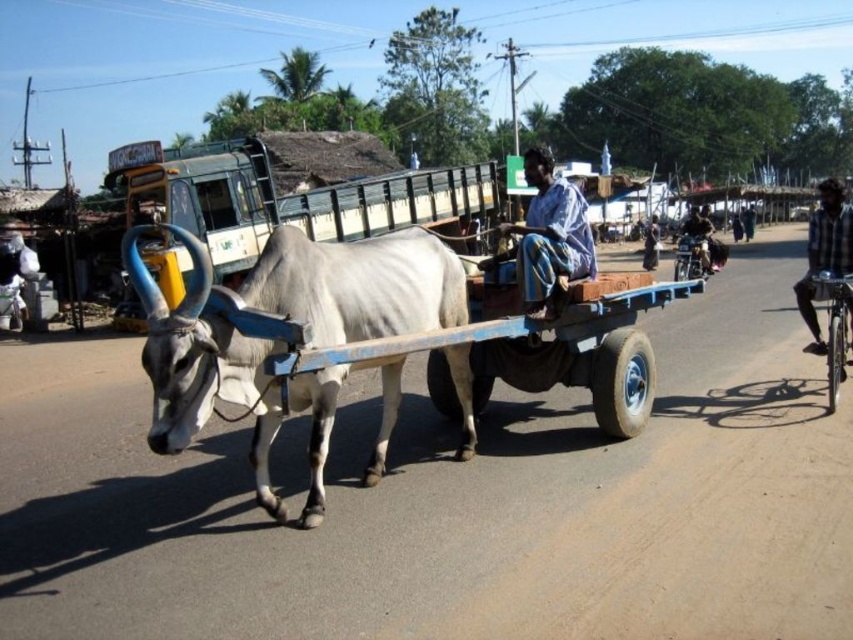
You are a passenger in the cart and need to get off to tie the blue fabric shirt at center. Which direction should you step to avoid the white matte bull at center?

The white matte bull at center is in front of the blue fabric shirt at center, so you should step to the side or behind to avoid the bull.

You are standing near the camera and want to take a photo of the white matte bull at center. If your camera has a maximum focus range of 3.5 meters, will you be able to capture the bull clearly?

The white matte bull at center and camera are 3.81 meters apart from each other. Since 3.81 meters exceeds the camera maximum focus range of 3.5 meters, you won not be able to capture the bull clearly.

Consider the image. You are standing at the origin point of the image coordinate system. There are two points marked in the scene. The first point is at coordinate point (262, 477) and the second point is at coordinate point (548, 225). If you were to walk from the first point to the second point, would you be moving towards the cow or away from it?

Since point (262, 477) is in front of point (548, 225), moving from the first point to the second point would mean moving away from the cow.